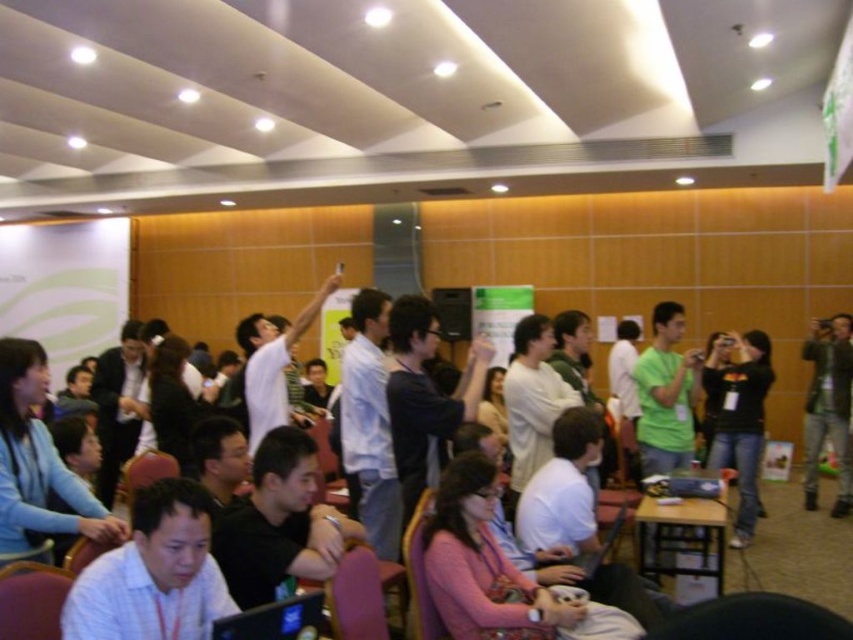
Question: Can you confirm if black cotton shirt at center is positioned to the right of green leather jacket at right?

Choices:
 (A) no
 (B) yes

Answer: (A)

Question: Among these objects, which one is nearest to the camera?

Choices:
 (A) black cotton shirt at center
 (B) green leather jacket at right

Answer: (A)

Question: Does black cotton shirt at center appear under green leather jacket at right?

Choices:
 (A) yes
 (B) no

Answer: (A)

Question: Which point is farther to the camera?

Choices:
 (A) black cotton shirt at center
 (B) green leather jacket at right

Answer: (B)

Question: Does black cotton shirt at center appear under green leather jacket at right?

Choices:
 (A) no
 (B) yes

Answer: (B)